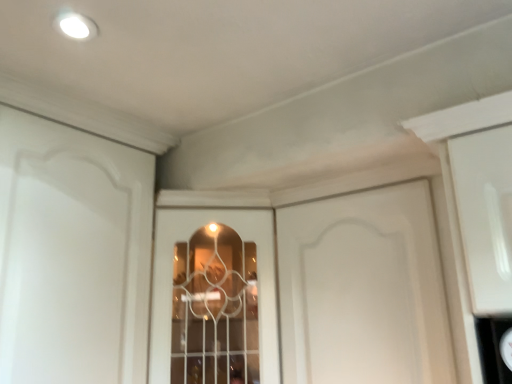
Question: Is white matte cabinet door at center bigger or smaller than clear glass window at center?

Choices:
 (A) big
 (B) small

Answer: (B)

Question: In terms of height, does white matte cabinet door at center look taller or shorter compared to clear glass window at center?

Choices:
 (A) tall
 (B) short

Answer: (B)

Question: From the image's perspective, is white matte cabinet door at center located above or below clear glass window at center?

Choices:
 (A) above
 (B) below

Answer: (A)

Question: Is clear glass window at center bigger or smaller than white matte cabinet door at center?

Choices:
 (A) small
 (B) big

Answer: (B)

Question: Considering the positions of point (164, 254) and point (410, 218), is point (164, 254) closer or farther from the camera than point (410, 218)?

Choices:
 (A) farther
 (B) closer

Answer: (A)

Question: Considering the positions of clear glass window at center and white matte cabinet door at center in the image, is clear glass window at center taller or shorter than white matte cabinet door at center?

Choices:
 (A) short
 (B) tall

Answer: (B)

Question: From the image's perspective, relative to white matte cabinet door at center, is clear glass window at center above or below?

Choices:
 (A) below
 (B) above

Answer: (A)